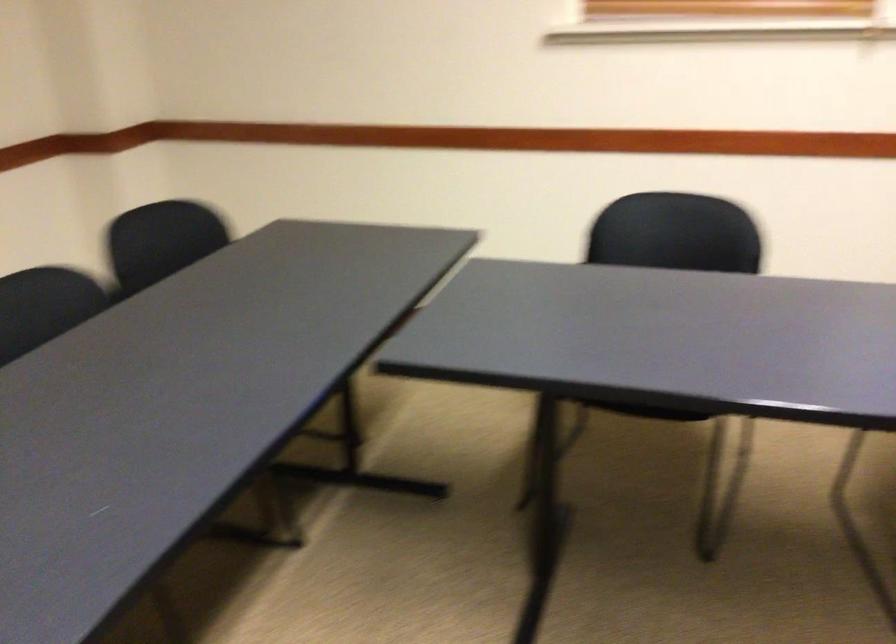
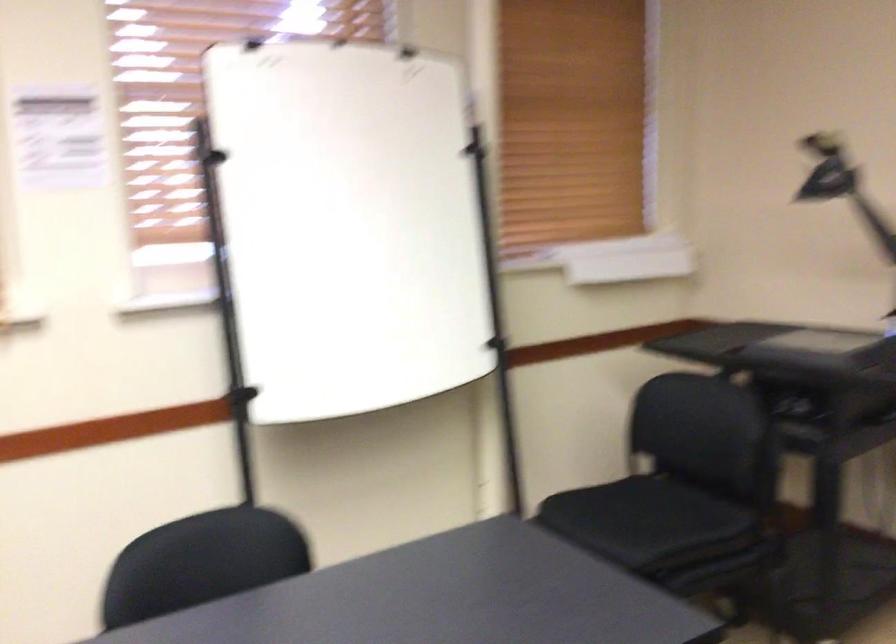
Question: The camera is either moving clockwise (left) or counter-clockwise (right) around the object. The first image is from the beginning of the video and the second image is from the end. Is the camera moving left or right when shooting the video?

Choices:
 (A) Left
 (B) Right

Answer: (A)